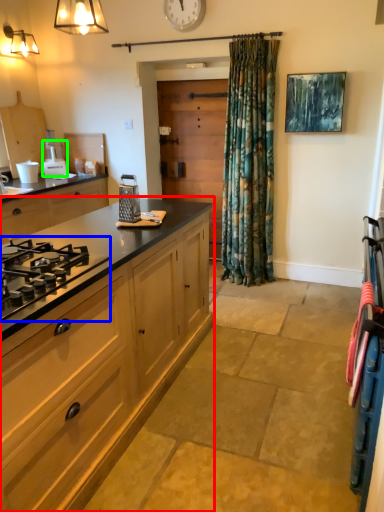
Question: Estimate the real-world distances between objects in this image. Which object is farther from cabinetry (highlighted by a red box), gas stove (highlighted by a blue box) or appliance (highlighted by a green box)?

Choices:
 (A) gas stove
 (B) appliance

Answer: (B)